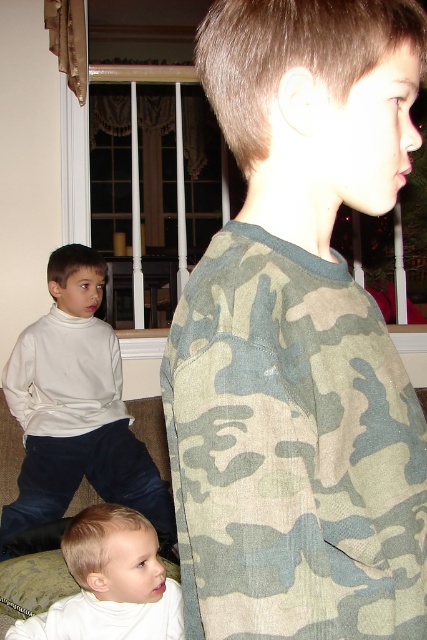
Question: Is camo fabric shirt at center positioned at the back of white soft baby at lower left?

Choices:
 (A) yes
 (B) no

Answer: (B)

Question: Is white turtleneck sweater at left positioned behind white soft baby at lower left?

Choices:
 (A) no
 (B) yes

Answer: (B)

Question: Which point is farther to the camera?

Choices:
 (A) white soft baby at lower left
 (B) camo fabric shirt at center

Answer: (A)

Question: Among these points, which one is nearest to the camera?

Choices:
 (A) (119, 560)
 (B) (236, 230)
 (C) (70, 280)

Answer: (B)

Question: Is white turtleneck sweater at left positioned before white soft baby at lower left?

Choices:
 (A) no
 (B) yes

Answer: (A)

Question: Which point appears closest to the camera in this image?

Choices:
 (A) (107, 456)
 (B) (394, 612)
 (C) (143, 573)

Answer: (B)